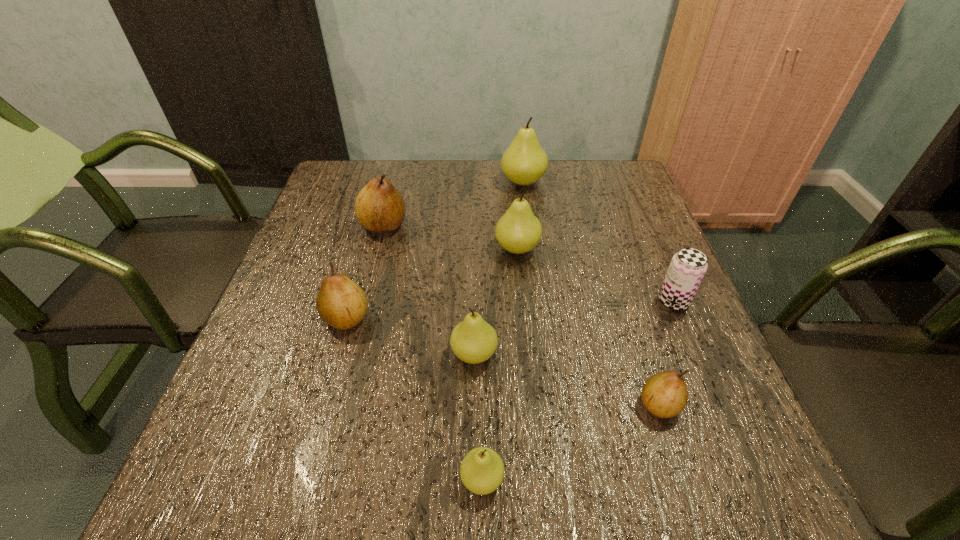
Identify which object is the sixth nearest to the farthest pear. Please provide its 2D coordinates. Your answer should be formatted as a tuple, i.e. [(x, y)], where the tuple contains the x and y coordinates of a point satisfying the conditions above.

[(664, 394)]

Identify which object is the fourth closest to the nearest pear. Please provide its 2D coordinates. Your answer should be formatted as a tuple, i.e. [(x, y)], where the tuple contains the x and y coordinates of a point satisfying the conditions above.

[(518, 231)]

In order to click on pear that stands as the sixth closest to the farthest object in this screenshot , I will do `click(482, 470)`.

Locate which pear ranks second in proximity to the nearest brown pear. Please provide its 2D coordinates. Your answer should be formatted as a tuple, i.e. [(x, y)], where the tuple contains the x and y coordinates of a point satisfying the conditions above.

[(482, 470)]

Identify the location of green pear that is the third closest to the second nearest green pear. (524, 162).

The width and height of the screenshot is (960, 540). I want to click on green pear that is the third closest one to the third farthest green pear, so click(524, 162).

I want to click on the closest brown pear to the farthest pear, so click(x=379, y=207).

Locate an element on the screen. The width and height of the screenshot is (960, 540). the closest brown pear to the biggest brown pear is located at coordinates (341, 303).

At what (x,y) coordinates should I click in order to perform the action: click on vacant space that satisfies the following two spatial constraints: 1. on the back side of the second nearest brown pear; 2. on the right side of the purple beer can. Please return your answer as a coordinate pair (x, y). Looking at the image, I should click on (351, 301).

What are the coordinates of `blank area in the image that satisfies the following two spatial constraints: 1. on the back side of the second farthest green pear; 2. on the right side of the third biggest green pear` in the screenshot? It's located at (475, 248).